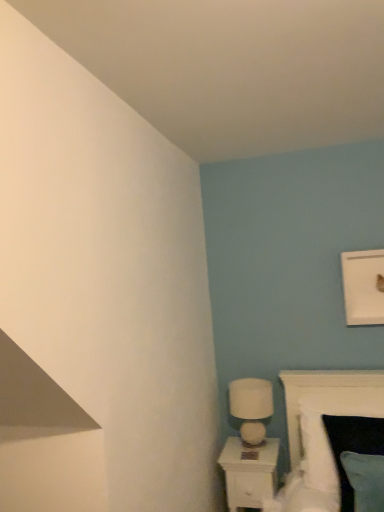
The image size is (384, 512). Find the location of `vacant location below white glossy table lamp at lower right (from a real-world perspective)`. vacant location below white glossy table lamp at lower right (from a real-world perspective) is located at coordinates (252, 445).